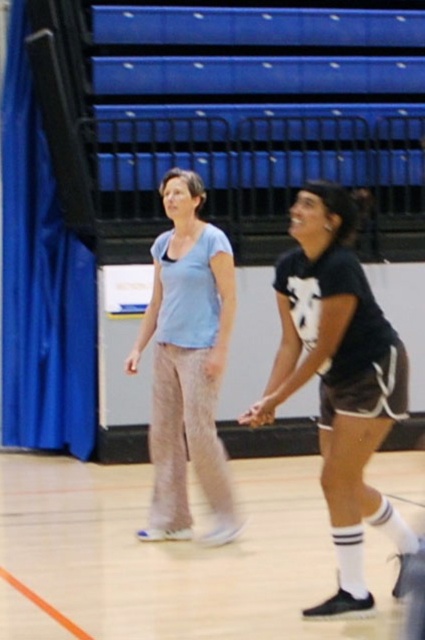
Based on the photo, you are a photographer standing at the back of the court. You want to take a photo of the white rubber shoes at lower center and the light blue cotton shirt at center. To ensure both are in frame, should you adjust your camera to focus more to the left or the right?

The white rubber shoes at lower center is positioned on the left side of light blue cotton shirt at center, so you should focus more to the left to include both objects in the frame.

You are a photographer positioned at the origin point of the coordinate system. You want to capture a photo of the black matte shorts at center. What is the direction you should aim your camera to capture the shorts?

The black matte shorts at center is located at point 0.594 on the x axis and 0.798 on the y axis. Since the photographer is at the origin, they should aim the camera towards the northeast direction to capture the black matte shorts at center.

You are designing a new locker room layout and need to ensure that the lockers can accommodate both the black matte shorts at center and the light blue cotton shirt at center. Based on the information provided, which clothing item requires more horizontal space in the locker compartment?

The black matte shorts at center might require more horizontal space in the locker compartment since they might be wider than the light blue cotton shirt at center.